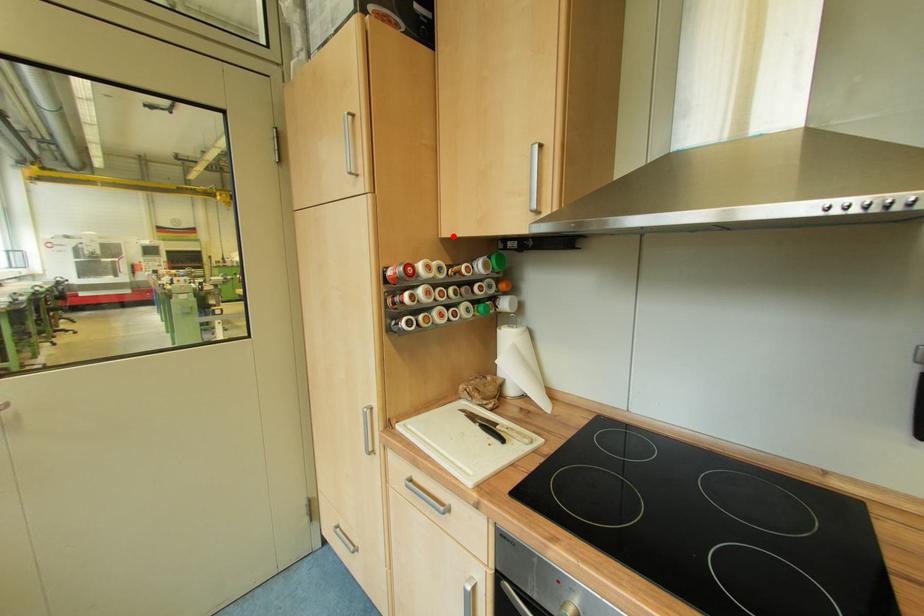
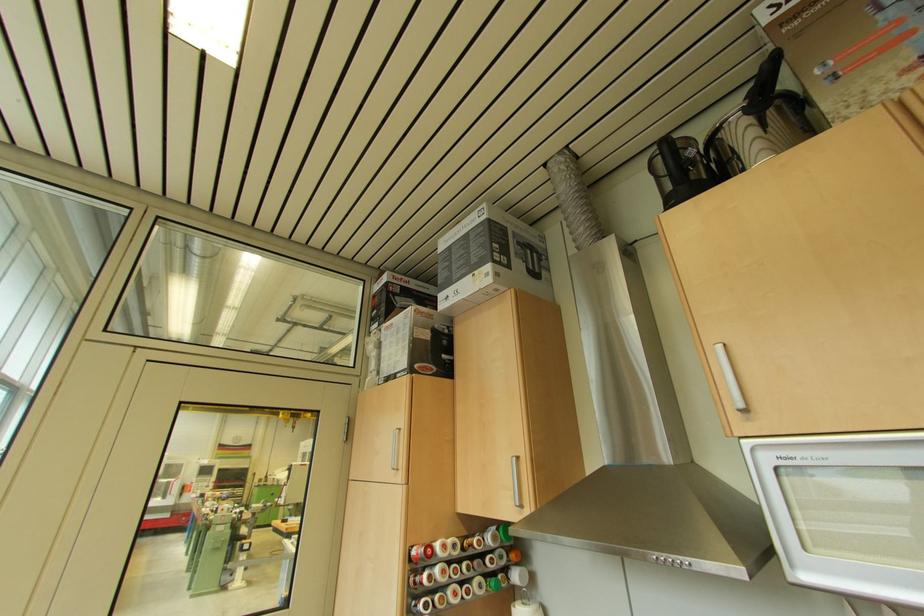
Question: I am providing you with two images of the same scene from different viewpoints. A red point is marked on the first image. Is the red point's position out of view in image 2?

Choices:
 (A) Yes
 (B) No

Answer: (B)